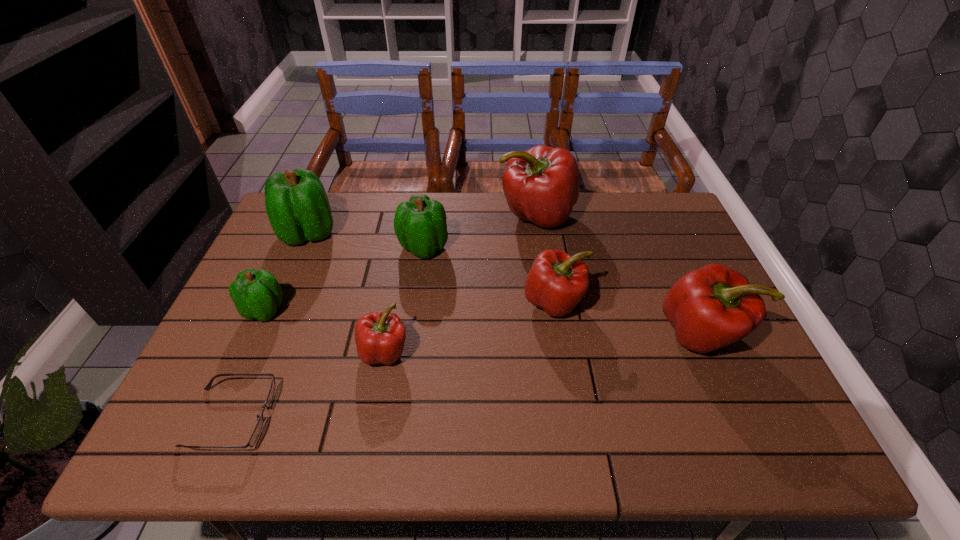
The image size is (960, 540). What are the coordinates of `unoccupied area between the smallest green bell pepper and the rightmost pink bell pepper` in the screenshot? It's located at (483, 322).

Where is `free spot between the biggest green bell pepper and the shortest object`? free spot between the biggest green bell pepper and the shortest object is located at coordinates (270, 325).

You are a GUI agent. You are given a task and a screenshot of the screen. Output one action in this format:
    pyautogui.click(x=<x>, y=<y>)
    Task: Click on the free area in between the biggest green bell pepper and the nearest object
    
    Given the screenshot: What is the action you would take?
    pyautogui.click(x=270, y=325)

In order to click on vacant space that is in between the second smallest pink bell pepper and the rightmost green bell pepper in this screenshot , I will do `click(489, 274)`.

Where is `vacant point located between the smallest pink bell pepper and the second smallest pink bell pepper`? The width and height of the screenshot is (960, 540). vacant point located between the smallest pink bell pepper and the second smallest pink bell pepper is located at coordinates (469, 327).

At what (x,y) coordinates should I click in order to perform the action: click on object that can be found as the fourth closest to the third biggest pink bell pepper. Please return your answer as a coordinate pair (x, y). The height and width of the screenshot is (540, 960). Looking at the image, I should click on [380, 337].

Identify which object is the closest to the rightmost green bell pepper. Please provide its 2D coordinates. Your answer should be formatted as a tuple, i.e. [(x, y)], where the tuple contains the x and y coordinates of a point satisfying the conditions above.

[(541, 185)]

Locate which bell pepper is the sixth closest to the biggest pink bell pepper. Please provide its 2D coordinates. Your answer should be formatted as a tuple, i.e. [(x, y)], where the tuple contains the x and y coordinates of a point satisfying the conditions above.

[(256, 294)]

Image resolution: width=960 pixels, height=540 pixels. Identify the location of bell pepper that is the fourth nearest to the smallest green bell pepper. (541, 185).

Identify which pink bell pepper is located as the third nearest to the biggest green bell pepper. Please provide its 2D coordinates. Your answer should be formatted as a tuple, i.e. [(x, y)], where the tuple contains the x and y coordinates of a point satisfying the conditions above.

[(556, 282)]